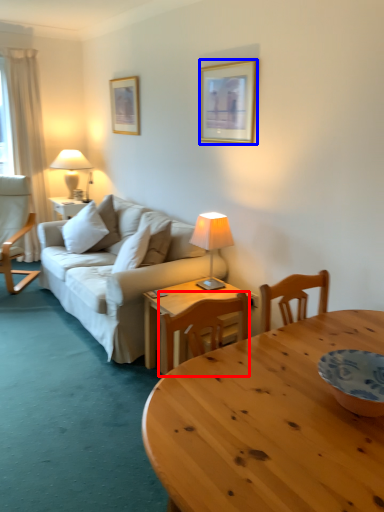
Question: Which object is closer to the camera taking this photo, chair (highlighted by a red box) or picture frame (highlighted by a blue box)?

Choices:
 (A) chair
 (B) picture frame

Answer: (A)